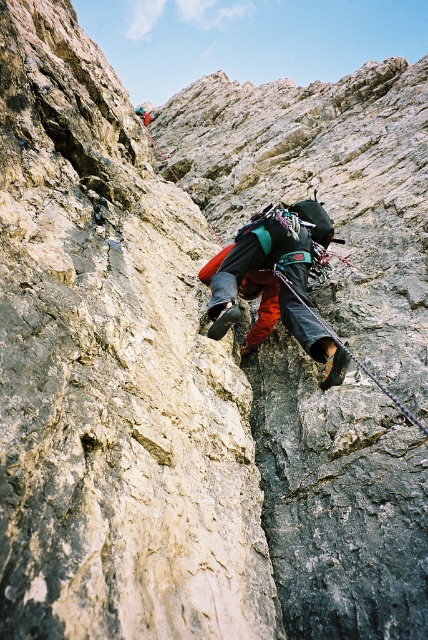
Is multicolored climbing gear at center shorter than black nylon rope at center?

Indeed, multicolored climbing gear at center has a lesser height compared to black nylon rope at center.

Is multicolored climbing gear at center taller than black nylon rope at center?

No.

From the picture: Who is more forward, (240, 230) or (413, 419)?

Point (413, 419) is in front.

This screenshot has width=428, height=640. Find the location of `multicolored climbing gear at center`. multicolored climbing gear at center is located at coordinates (267, 259).